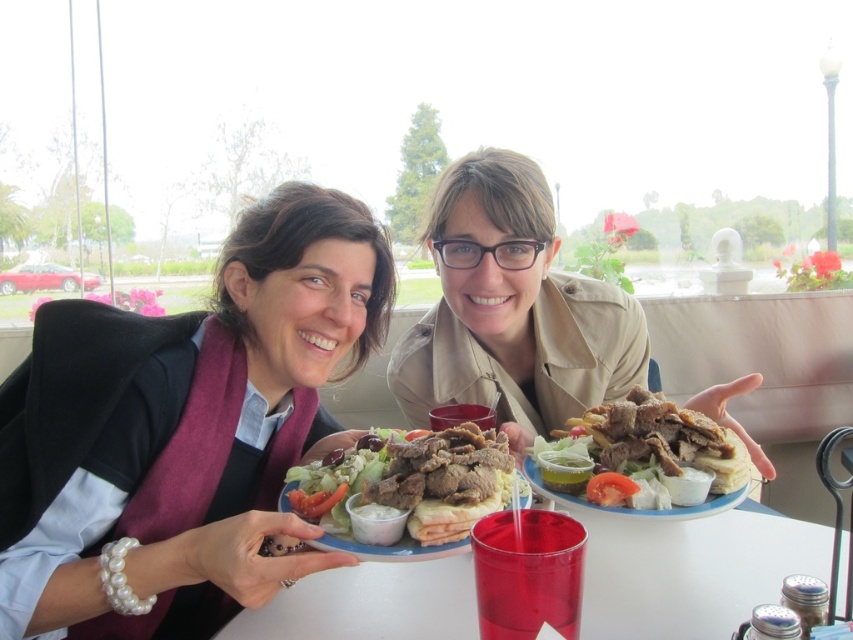
In the scene shown: How distant is transparent plastic cup at center from golden brown pita bread at center?

transparent plastic cup at center and golden brown pita bread at center are 13.82 centimeters apart from each other.

Who is lower down, transparent plastic cup at center or golden brown pita bread at center?

transparent plastic cup at center is lower down.

Find the location of a particular element. The image size is (853, 640). transparent plastic cup at center is located at coordinates pos(689,572).

Does point (68, 512) lie in front of point (786, 566)?

Yes.

Is matte black plate at center bigger than transparent plastic cup at center?

Correct, matte black plate at center is larger in size than transparent plastic cup at center.

What are the coordinates of `matte black plate at center` in the screenshot? It's located at (184, 429).

Identify the location of matte black plate at center. The image size is (853, 640). (184, 429).

Who is taller, matte black sweater at center or golden brown pita bread at center?

With more height is matte black sweater at center.

From the picture: Between matte black sweater at center and golden brown pita bread at center, which one is positioned higher?

Positioned higher is matte black sweater at center.

Which is in front, point (247, 340) or point (543, 477)?

Point (543, 477) is more forward.

Find the location of a particular element. This screenshot has width=853, height=640. matte black sweater at center is located at coordinates coord(184,424).